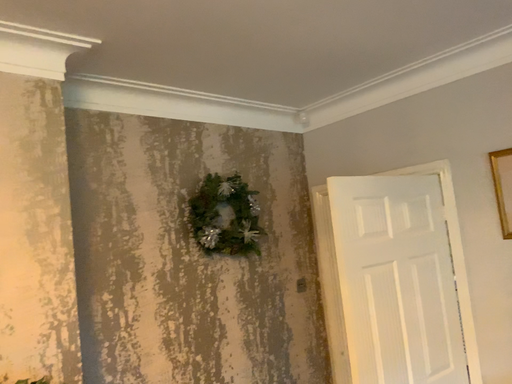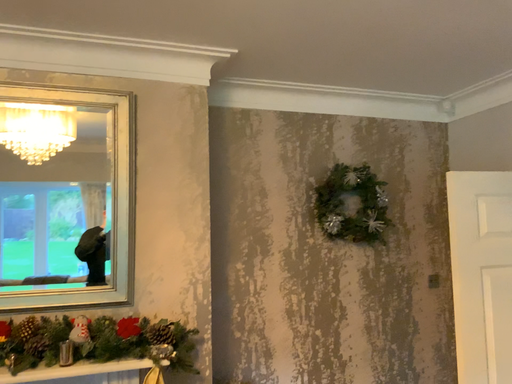
Question: How did the camera likely rotate when shooting the video?

Choices:
 (A) rotated right
 (B) rotated left

Answer: (B)